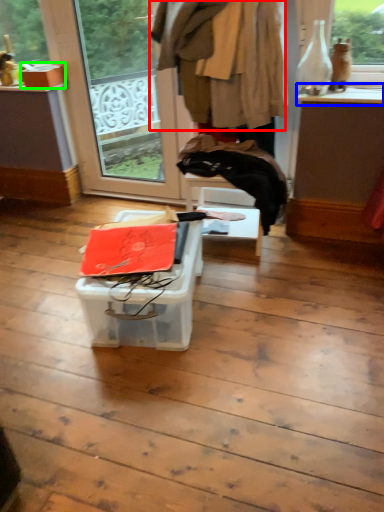
Question: Considering the real-world distances, which object is closest to clothing (highlighted by a red box)? window sill (highlighted by a blue box) or cardboard box (highlighted by a green box).

Choices:
 (A) window sill
 (B) cardboard box

Answer: (A)